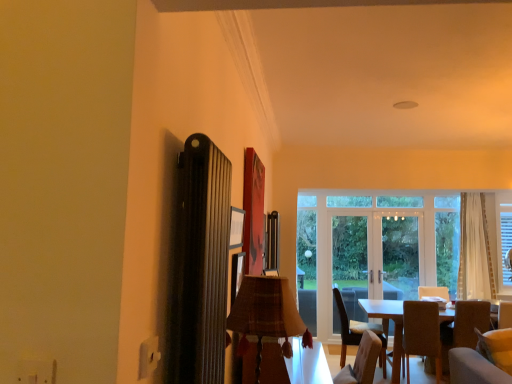
Question: Is clear glass door at center, which is counted as the 1th screen door, starting from the left, touching brown fabric chair at lower right, which appears as the first chair when viewed from the left?

Choices:
 (A) no
 (B) yes

Answer: (A)

Question: Does clear glass door at center, which is counted as the 1th screen door, starting from the left, have a lesser width compared to brown fabric chair at lower right, which appears as the first chair when viewed from the left?

Choices:
 (A) yes
 (B) no

Answer: (A)

Question: Can you confirm if clear glass door at center, which is counted as the 1th screen door, starting from the left, is taller than brown fabric chair at lower right, which appears as the first chair when viewed from the left?

Choices:
 (A) no
 (B) yes

Answer: (B)

Question: Is the depth of clear glass door at center, which is the second screen door from right to left, greater than that of brown fabric chair at lower right, which is counted as the second chair, starting from the right?

Choices:
 (A) yes
 (B) no

Answer: (A)

Question: Considering the relative sizes of clear glass door at center, which is counted as the 1th screen door, starting from the left, and brown fabric chair at lower right, which is counted as the second chair, starting from the right, in the image provided, is clear glass door at center, which is counted as the 1th screen door, starting from the left, shorter than brown fabric chair at lower right, which is counted as the second chair, starting from the right,?

Choices:
 (A) yes
 (B) no

Answer: (B)

Question: Considering the positions of velvet beige couch at lower right and soft beige fabric armchair at lower right in the image, is velvet beige couch at lower right taller or shorter than soft beige fabric armchair at lower right?

Choices:
 (A) short
 (B) tall

Answer: (A)

Question: Considering their positions, is velvet beige couch at lower right located in front of or behind soft beige fabric armchair at lower right?

Choices:
 (A) behind
 (B) front

Answer: (B)

Question: Is velvet beige couch at lower right inside the boundaries of soft beige fabric armchair at lower right, or outside?

Choices:
 (A) outside
 (B) inside

Answer: (A)

Question: Is velvet beige couch at lower right wider or thinner than soft beige fabric armchair at lower right?

Choices:
 (A) wide
 (B) thin

Answer: (A)

Question: In terms of size, does clear glass door at center, which is the second screen door from right to left, appear bigger or smaller than velvet beige couch at lower right?

Choices:
 (A) small
 (B) big

Answer: (A)

Question: Is clear glass door at center, which is counted as the 1th screen door, starting from the left, taller or shorter than velvet beige couch at lower right?

Choices:
 (A) tall
 (B) short

Answer: (A)

Question: Relative to velvet beige couch at lower right, is clear glass door at center, which is the second screen door from right to left, in front or behind?

Choices:
 (A) front
 (B) behind

Answer: (B)

Question: Is clear glass door at center, which is counted as the 1th screen door, starting from the left, wider or thinner than velvet beige couch at lower right?

Choices:
 (A) thin
 (B) wide

Answer: (A)

Question: Based on their positions, is dark wood table at lower right, positioned as the first table in back-to-front order, located to the left or right of transparent glass window at center?

Choices:
 (A) left
 (B) right

Answer: (A)

Question: From a real-world perspective, is dark wood table at lower right, the second table from the left, above or below transparent glass window at center?

Choices:
 (A) below
 (B) above

Answer: (A)